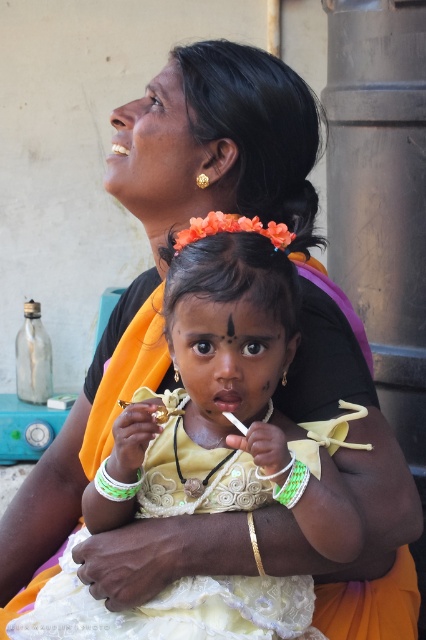
Looking at the scene, where is the matte gold necklace at center in relation to the white plastic bracelet at lower center?

The matte gold necklace at center is to the right of the white plastic bracelet at lower center.

You are an artist preparing to sketch this scene. You need to decide which object to draw first based on size. Which one should you start with, the white lace dress at center or the green woven bracelet at center?

The white lace dress at center is bigger than the green woven bracelet at center, so you should start by drawing the white lace dress at center first.